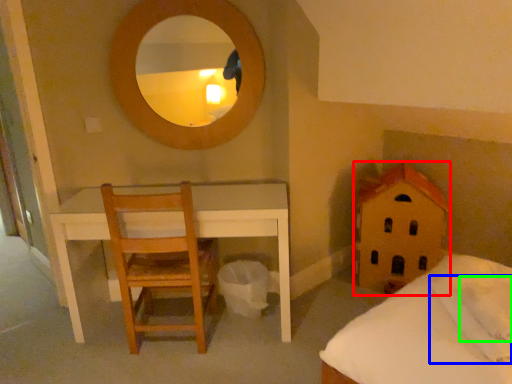
Question: Considering the real-world distances, which object is farthest from toy (highlighted by a red box)? pillow (highlighted by a blue box) or pillow (highlighted by a green box)?

Choices:
 (A) pillow
 (B) pillow

Answer: (B)